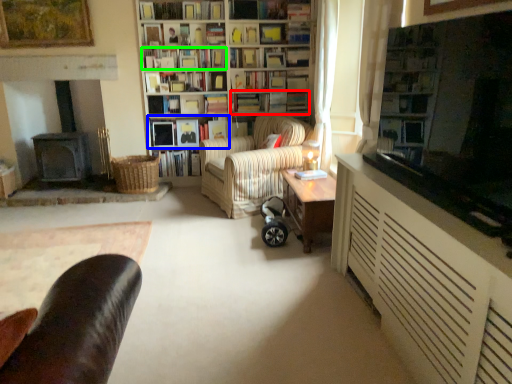
Question: Estimate the real-world distances between objects in this image. Which object is closer to book (highlighted by a red box), book (highlighted by a blue box) or book (highlighted by a green box)?

Choices:
 (A) book
 (B) book

Answer: (A)